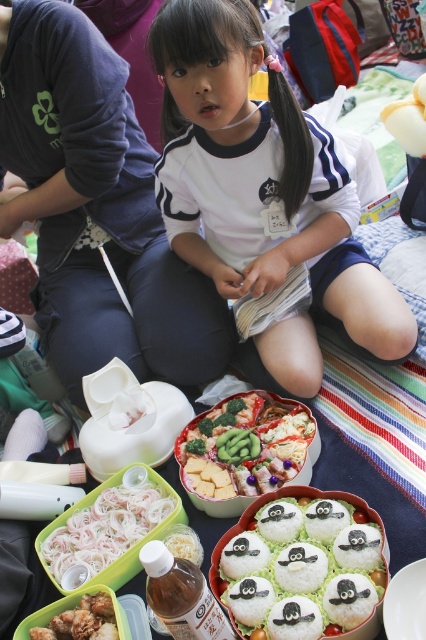
You are a photographer trying to capture the girl in the scene. You want to ensure that the point at coordinate (259, 177) is visible in your photo. Which part of the girl should you focus on to include this point?

The point at coordinate (259, 177) is on the white cotton shirt at center, so you should focus on the girl to include her shirt in the photo.

You are a photographer trying to capture the girl in the scene. Since you want to focus on her clothing, which object should you adjust your camera to prioritize between the white cotton shirt at center and the white rice with penguin designs at center?

The white cotton shirt at center is larger in size than the white rice with penguin designs at center, so you should prioritize focusing on the white cotton shirt at center as it is bigger and more prominent.

You are standing 1.5 meters away from the picnic scene. If you want to reach the point at coordinates point (x=265, y=513), will you be able to touch it without moving closer?

The distance of point (x=265, y=513) from viewer is 1.23 meters. Since you are currently 1.5 meters away, you are farther than the point, so you can reach it without moving closer.